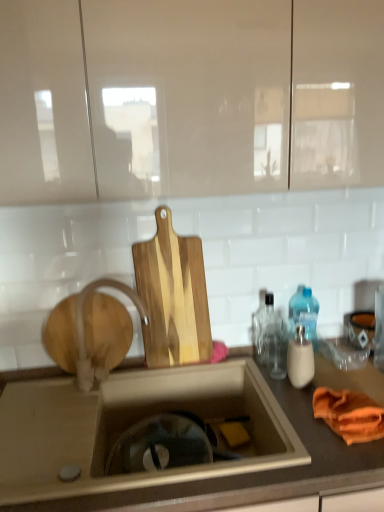
Question: Relative to natural wood cutting board at center, is white matte faucet at center in front or behind?

Choices:
 (A) front
 (B) behind

Answer: (A)

Question: From the image's perspective, is white matte faucet at center located above or below natural wood cutting board at center?

Choices:
 (A) above
 (B) below

Answer: (B)

Question: Estimate the real-world distances between objects in this image. Which object is closer to the translucent glass bottle at right, which is the first bottle from front to back?

Choices:
 (A) orange cloth at right
 (B) white matte faucet at center
 (C) natural wood cutting board at center
 (D) transparent glass bottle at right, which ranks as the second bottle in front-to-back order
 (E) matte gray countertop at center

Answer: (D)

Question: Which object is positioned farthest from the translucent glass bottle at right, which is the first bottle from front to back?

Choices:
 (A) natural wood cutting board at center
 (B) matte gray countertop at center
 (C) white matte faucet at center
 (D) transparent glass bottle at right, which is the 2th bottle in back-to-front order
 (E) wooden at left

Answer: (E)